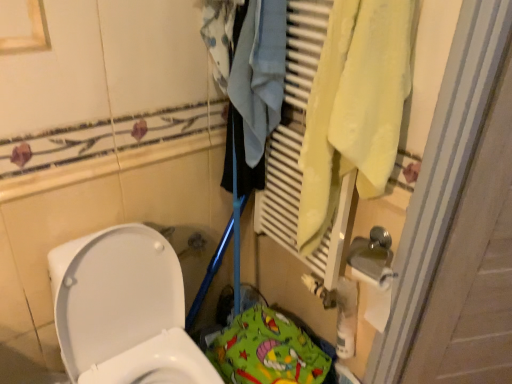
Question: Is green fabric play mat at lower center shorter than white glossy toilet at lower left?

Choices:
 (A) no
 (B) yes

Answer: (B)

Question: Is green fabric play mat at lower center positioned before white glossy toilet at lower left?

Choices:
 (A) no
 (B) yes

Answer: (A)

Question: Is green fabric play mat at lower center completely or partially outside of white glossy toilet at lower left?

Choices:
 (A) no
 (B) yes

Answer: (B)

Question: Does green fabric play mat at lower center lie behind white glossy toilet at lower left?

Choices:
 (A) yes
 (B) no

Answer: (A)

Question: Does green fabric play mat at lower center turn towards white glossy toilet at lower left?

Choices:
 (A) no
 (B) yes

Answer: (A)

Question: Choose the correct answer: Is yellow fabric towel at right inside white glossy toilet at lower left or outside it?

Choices:
 (A) outside
 (B) inside

Answer: (A)

Question: In terms of width, does yellow fabric towel at right look wider or thinner when compared to white glossy toilet at lower left?

Choices:
 (A) thin
 (B) wide

Answer: (A)

Question: From the image's perspective, relative to white glossy toilet at lower left, is yellow fabric towel at right above or below?

Choices:
 (A) below
 (B) above

Answer: (B)

Question: Considering the positions of point (296, 235) and point (168, 279), is point (296, 235) closer or farther from the camera than point (168, 279)?

Choices:
 (A) farther
 (B) closer

Answer: (A)

Question: From a real-world perspective, is green fabric play mat at lower center above or below white glossy toilet at lower left?

Choices:
 (A) below
 (B) above

Answer: (A)

Question: Is green fabric play mat at lower center bigger or smaller than white glossy toilet at lower left?

Choices:
 (A) big
 (B) small

Answer: (B)

Question: Is green fabric play mat at lower center situated inside white glossy toilet at lower left or outside?

Choices:
 (A) outside
 (B) inside

Answer: (A)

Question: Looking at their shapes, would you say green fabric play mat at lower center is wider or thinner than white glossy toilet at lower left?

Choices:
 (A) wide
 (B) thin

Answer: (B)

Question: Is point (87, 369) closer or farther from the camera than point (223, 357)?

Choices:
 (A) farther
 (B) closer

Answer: (B)

Question: Would you say white glossy toilet at lower left is to the left or to the right of green fabric play mat at lower center in the picture?

Choices:
 (A) left
 (B) right

Answer: (A)